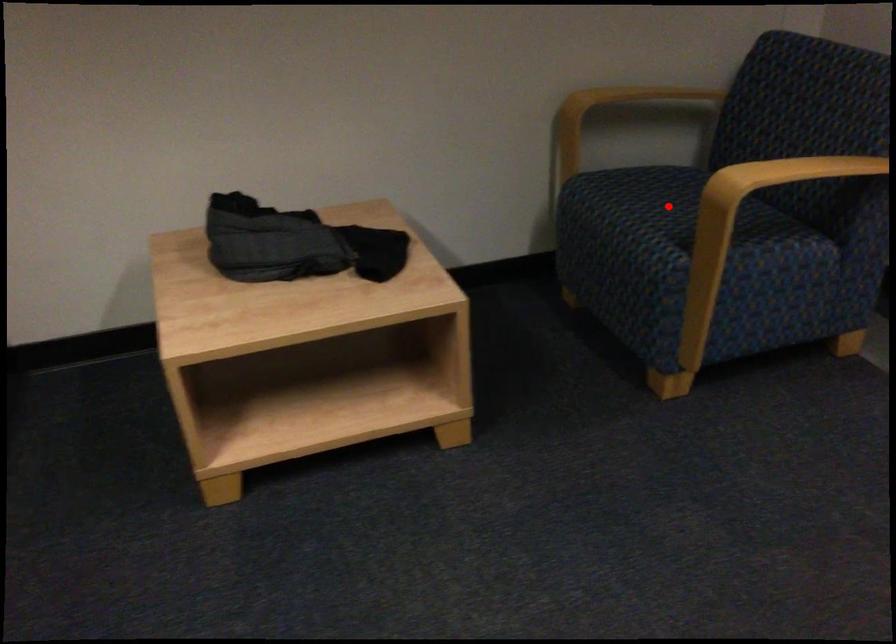
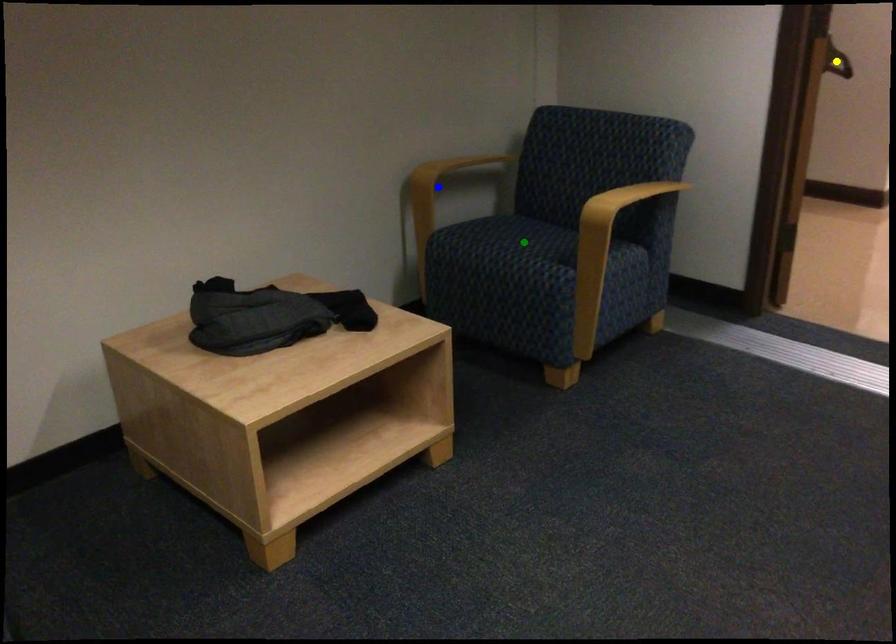
Question: I am providing you with two images of the same scene from different viewpoints. A red point is marked on the first image. You are given multiple points on the second image. In image 2, which mark is for the same physical point as the one in image 1?

Choices:
 (A) yellow point
 (B) blue point
 (C) green point

Answer: (C)